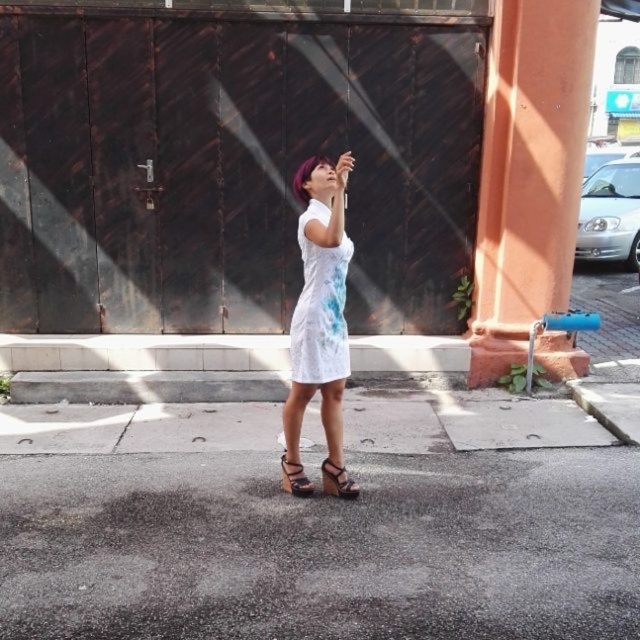
Which of these two, white lace dress at center or matte black wedge sandal at center, stands shorter?

matte black wedge sandal at center is shorter.

Measure the distance between white lace dress at center and matte black wedge sandal at center.

white lace dress at center and matte black wedge sandal at center are 26.70 inches apart from each other.

The width and height of the screenshot is (640, 640). I want to click on white lace dress at center, so click(320, 307).

This screenshot has height=640, width=640. What do you see at coordinates (320, 323) in the screenshot?
I see `white matte dress at center` at bounding box center [320, 323].

Can you confirm if white matte dress at center is positioned below brown leather sandal at center?

No, white matte dress at center is not below brown leather sandal at center.

The image size is (640, 640). Identify the location of white matte dress at center. (320, 323).

What do you see at coordinates (232, 161) in the screenshot? I see `dark brown corrugated metal at center` at bounding box center [232, 161].

In the scene shown: Is the position of dark brown corrugated metal at center more distant than that of matte black wedge sandal at center?

Yes, dark brown corrugated metal at center is further from the viewer.

Does point (241, 195) come behind point (326, 470)?

Yes, it is behind point (326, 470).

Where is `dark brown corrugated metal at center`? This screenshot has width=640, height=640. dark brown corrugated metal at center is located at coordinates (232, 161).